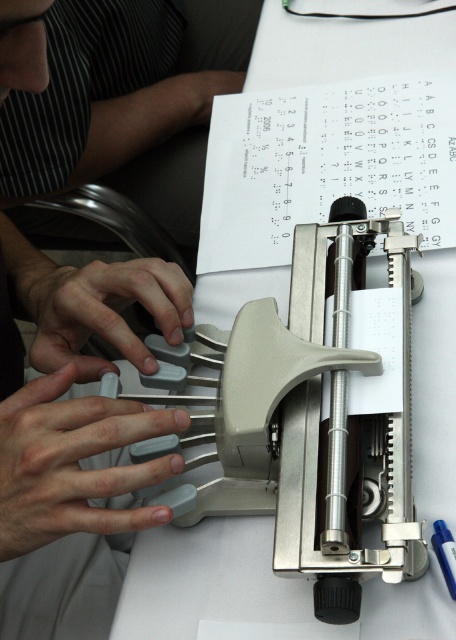
You are a visually impaired user trying to locate the gray rubberized keys at center and the gray rubber keys at center on the Braille writer. Which set of keys has a smaller width?

The gray rubberized keys at center has a lesser width compared to the gray rubber keys at center, so the gray rubberized keys at center are smaller in width.

You are a visually impaired student learning to use a Braille writer. You notice a specific point marked at coordinates (73, 461). Where is this point located on the Braille writer?

The point at (73, 461) is on the gray rubberized keys at center of the Braille writer.

You are a visually impaired student learning to use a Braille writer. You notice two sets of keys on the device. One set is labeled as gray rubberized keys at center and the other as gray rubber keys at center. Which set of keys is smaller in size?

The gray rubberized keys at center are smaller in size compared to the gray rubber keys at center according to the description.